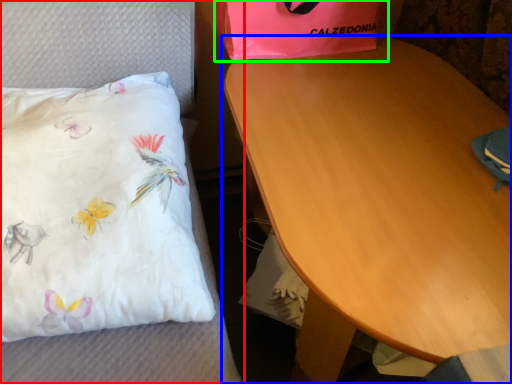
Question: Which is farther away from furniture (highlighted by a red box)? table (highlighted by a blue box) or gift bag (highlighted by a green box)?

Choices:
 (A) table
 (B) gift bag

Answer: (A)